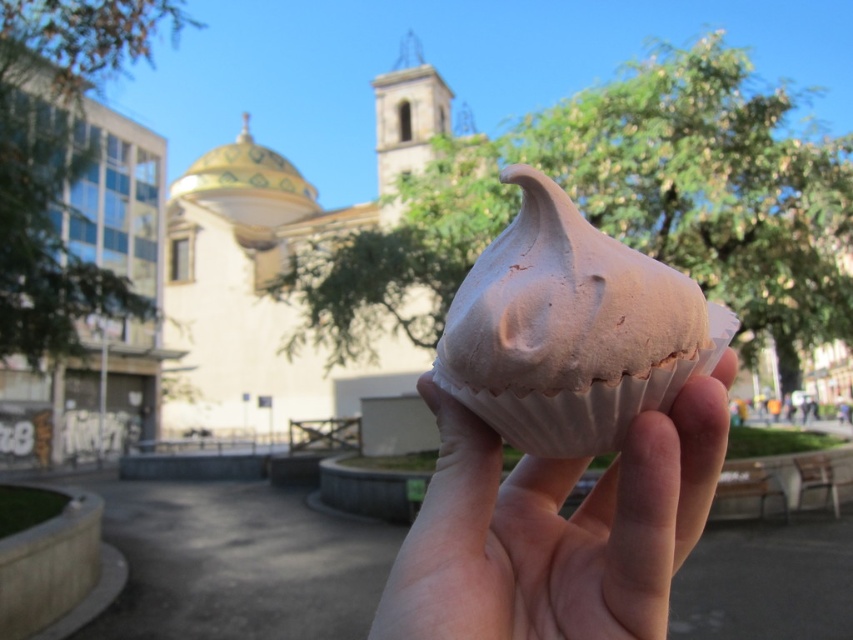
Question: Can you confirm if beige stone church at center is positioned above chocolate matte muffin at center?

Choices:
 (A) no
 (B) yes

Answer: (B)

Question: Which point appears farthest from the camera in this image?

Choices:
 (A) (527, 355)
 (B) (415, 364)

Answer: (B)

Question: Is beige stone church at center bigger than chocolate matte muffin at center?

Choices:
 (A) yes
 (B) no

Answer: (A)

Question: Which point is closer to the camera?

Choices:
 (A) (308, 243)
 (B) (556, 525)
 (C) (520, 342)

Answer: (C)

Question: Which point is closer to the camera taking this photo?

Choices:
 (A) (436, 364)
 (B) (234, 266)

Answer: (A)

Question: Is white paper cupcake at center positioned in front of chocolate matte muffin at center?

Choices:
 (A) yes
 (B) no

Answer: (B)